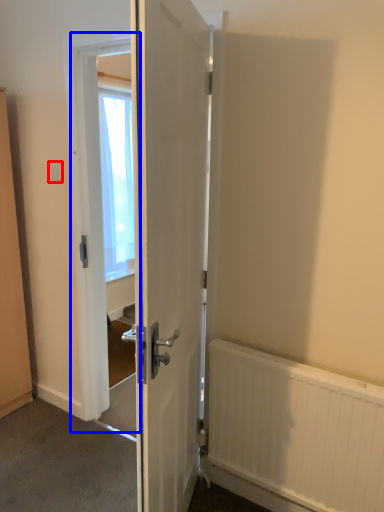
Question: Which object is closer to the camera taking this photo, electric outlet (highlighted by a red box) or screen door (highlighted by a blue box)?

Choices:
 (A) electric outlet
 (B) screen door

Answer: (B)